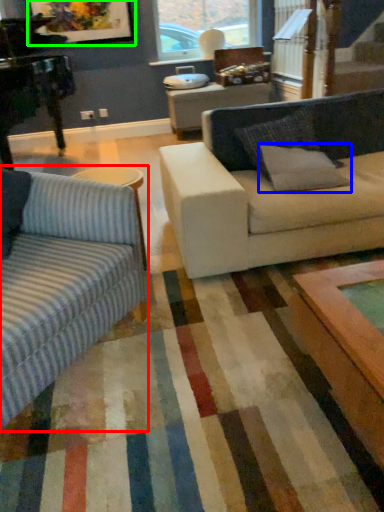
Question: Which object is the closest to the studio couch (highlighted by a red box)? Choose among these: pillow (highlighted by a blue box) or picture frame (highlighted by a green box).

Choices:
 (A) pillow
 (B) picture frame

Answer: (A)